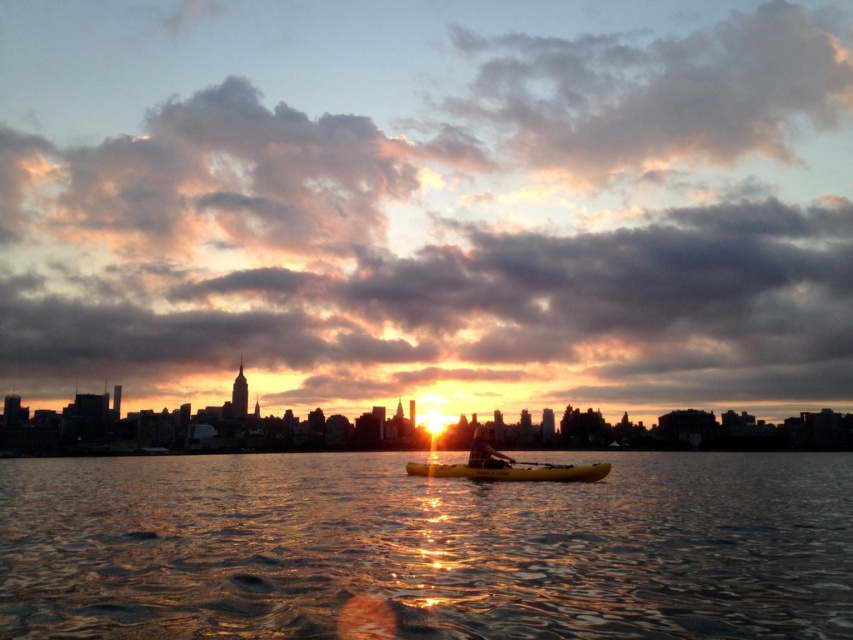
Who is higher up, yellow matte canoe at center or wooden paddle at center?

wooden paddle at center

Is yellow matte canoe at center above wooden paddle at center?

No.

Who is more forward, (519, 468) or (538, 467)?

Positioned in front is point (519, 468).

You are a GUI agent. You are given a task and a screenshot of the screen. Output one action in this format:
    pyautogui.click(x=<x>, y=<y>)
    Task: Click on the yellow matte canoe at center
    
    Given the screenshot: What is the action you would take?
    pyautogui.click(x=512, y=472)

Is the position of smooth yellow kayak at center less distant than that of wooden paddle at center?

That is False.

Consider the image. Who is lower down, smooth yellow kayak at center or wooden paddle at center?

Positioned lower is smooth yellow kayak at center.

Does point (485, 467) come farther from viewer compared to point (560, 467)?

Yes, point (485, 467) is farther from viewer.

Identify the location of smooth yellow kayak at center. (485, 452).

Which is more to the left, glistening water at center or yellow matte canoe at center?

glistening water at center

Who is higher up, glistening water at center or yellow matte canoe at center?

yellow matte canoe at center is above.

This screenshot has width=853, height=640. What do you see at coordinates (425, 548) in the screenshot?
I see `glistening water at center` at bounding box center [425, 548].

Locate an element on the screen. glistening water at center is located at coordinates (425, 548).